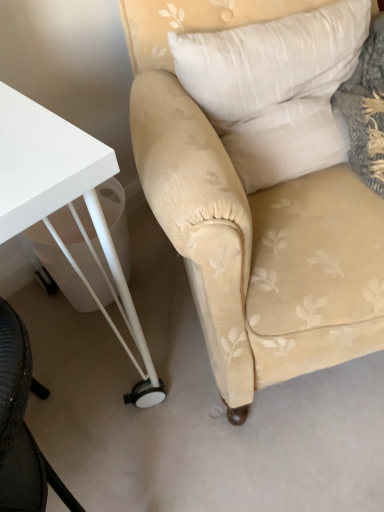
Where is `empty space that is to the right of white glossy table at lower left`? The image size is (384, 512). empty space that is to the right of white glossy table at lower left is located at coordinates (206, 381).